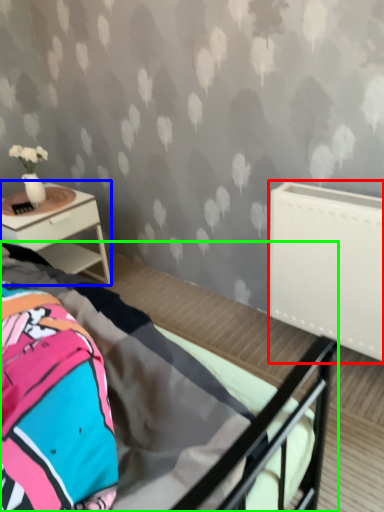
Question: Which object is the farthest from radiator (highlighted by a red box)? Choose among these: nightstand (highlighted by a blue box) or bed (highlighted by a green box).

Choices:
 (A) nightstand
 (B) bed

Answer: (A)